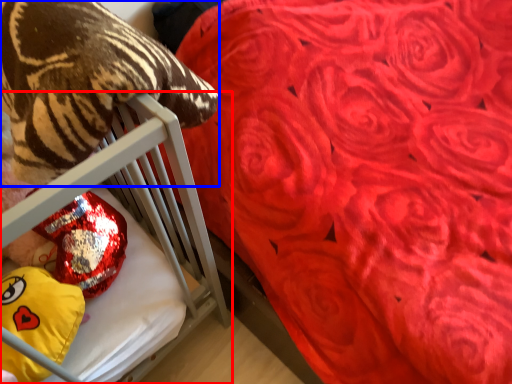
Question: Which of the following is the farthest to the observer, furniture (highlighted by a red box) or animal (highlighted by a blue box)?

Choices:
 (A) furniture
 (B) animal

Answer: (A)